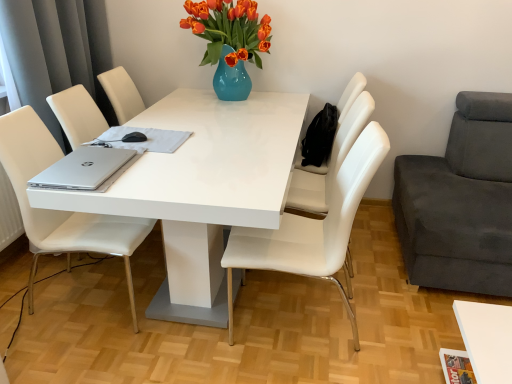
The height and width of the screenshot is (384, 512). I want to click on free region under white leather chair at left, which is counted as the 4th chair, starting from the right (from a real-world perspective), so click(x=84, y=292).